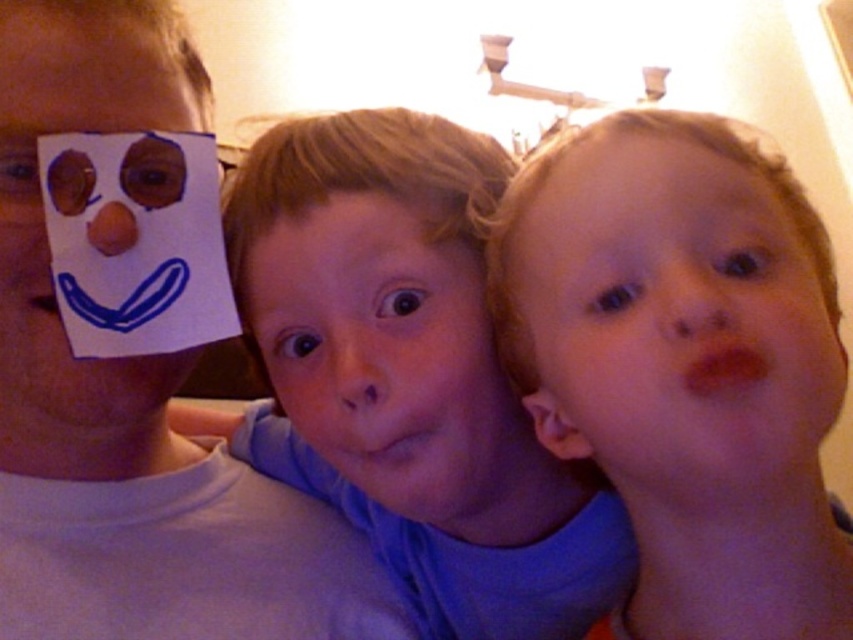
You are a photographer trying to capture a closeup of the smooth blue shirt at center and the matte paper face at left. Which object should you zoom in on first to ensure both fit in the frame?

The smooth blue shirt at center is larger in size than the matte paper face at left, so you should zoom in on the matte paper face at left first to ensure both fit in the frame.

You are a photographer trying to capture a group photo. You notice two faces in the scene, the smooth skin face at right and the smooth skin face at center. Which face should you focus on first to ensure it is in sharp focus?

The smooth skin face at right is closer to the viewer than the smooth skin face at center, so you should focus on the smooth skin face at right first to ensure it is in sharp focus.

You are a photographer trying to capture a closeup shot of the smooth skin face at center without the smooth blue shirt at center blocking the view. Based on their sizes, which one should you adjust your camera focus to prioritize?

The smooth blue shirt at center is larger in size than the smooth skin face at center, so you should adjust your camera focus to prioritize the smooth skin face at center to ensure it is clearly visible without obstruction.